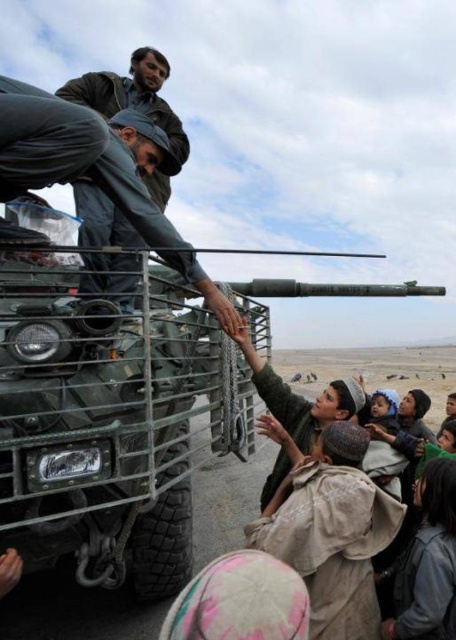
Can you confirm if green matte tank at lower left is positioned above dark green uniform at upper left?

Actually, green matte tank at lower left is below dark green uniform at upper left.

Image resolution: width=456 pixels, height=640 pixels. What do you see at coordinates (108, 422) in the screenshot?
I see `green matte tank at lower left` at bounding box center [108, 422].

I want to click on green matte tank at lower left, so click(x=108, y=422).

Which is behind, point (13, 356) or point (150, 230)?

Point (150, 230)

What do you see at coordinates (108, 422) in the screenshot?
I see `green matte tank at lower left` at bounding box center [108, 422].

This screenshot has width=456, height=640. What are the coordinates of `green matte tank at lower left` in the screenshot? It's located at (108, 422).

Is matte green uniform at left closer to camera compared to dark green uniform at upper left?

Yes, it is.

Who is more distant from viewer, (x=20, y=88) or (x=97, y=268)?

Positioned behind is point (x=97, y=268).

Find the location of `matte green uniform at left`. matte green uniform at left is located at coordinates (91, 173).